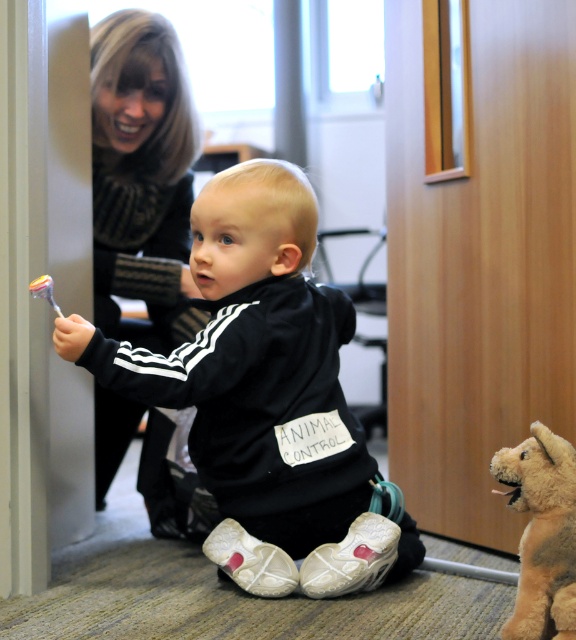
You are a robot with a 24 inch arm reach. You need to grab the translucent plastic toothbrush at lower left from the blonde hair at upper left. Can your arm reach it?

The blonde hair at upper left is 27.63 inches away from the translucent plastic toothbrush at lower left. Since your arm can only reach 24 inches, you cannot reach the toothbrush from the hair.

What is located at the coordinate point (142, 179) in the image?

The blonde hair at upper left is located at point (142, 179).